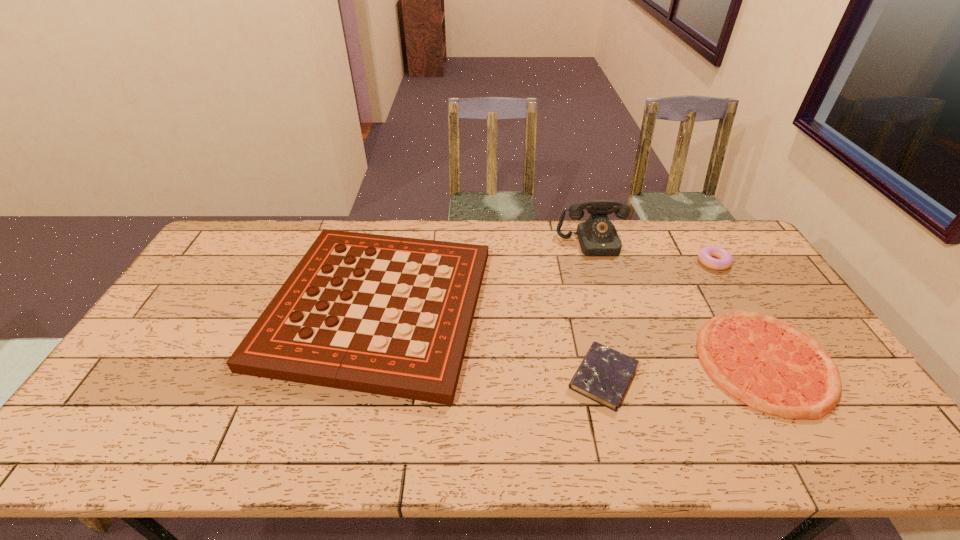
In order to click on the tallest object in this screenshot , I will do `click(597, 236)`.

You are a GUI agent. You are given a task and a screenshot of the screen. Output one action in this format:
    pyautogui.click(x=<x>, y=<y>)
    Task: Click on the gameboard
    
    Given the screenshot: What is the action you would take?
    pyautogui.click(x=386, y=315)

In order to click on the leftmost object in this screenshot , I will do `click(386, 315)`.

Find the location of `doughnut`. doughnut is located at coordinates (725, 259).

Identify the location of pizza. Image resolution: width=960 pixels, height=540 pixels. (772, 366).

Locate an element on the screen. diary is located at coordinates (604, 374).

At what (x,y) coordinates should I click in order to perform the action: click on vacant space positioned on the dial of the telephone. Please return your answer as a coordinate pair (x, y). Looking at the image, I should click on (606, 285).

Find the location of a particular element. The height and width of the screenshot is (540, 960). vacant space located 0.190m on the right of the fourth shortest object is located at coordinates (552, 307).

The image size is (960, 540). I want to click on vacant space situated on the left of the third shortest object, so click(653, 262).

At what (x,y) coordinates should I click in order to perform the action: click on vacant space positioned on the left of the pizza. Please return your answer as a coordinate pair (x, y). This screenshot has width=960, height=540. Looking at the image, I should click on (618, 362).